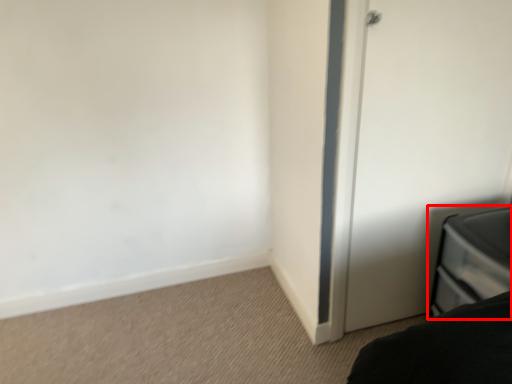
Question: From the image, what is the correct spatial relationship of furniture (annotated by the red box) in relation to door?

Choices:
 (A) right
 (B) left

Answer: (A)